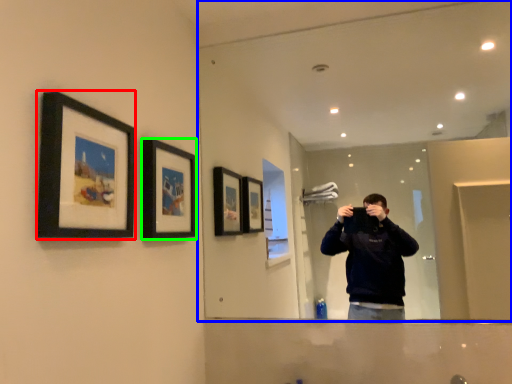
Question: Based on their relative distances, which object is farther from picture frame (highlighted by a red box)? Choose from mirror (highlighted by a blue box) and picture frame (highlighted by a green box).

Choices:
 (A) mirror
 (B) picture frame

Answer: (A)